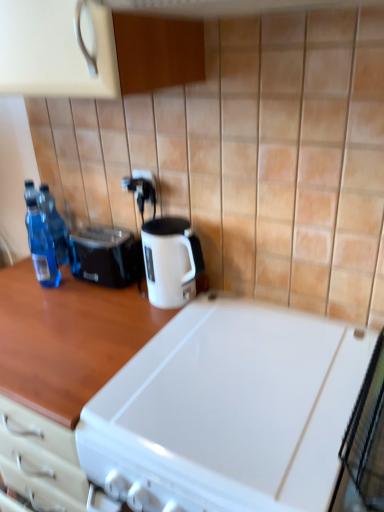
Identify the location of free space in front of transparent plastic bottles at left, marked as the second bottle in a front-to-back arrangement. Image resolution: width=384 pixels, height=512 pixels. (44, 290).